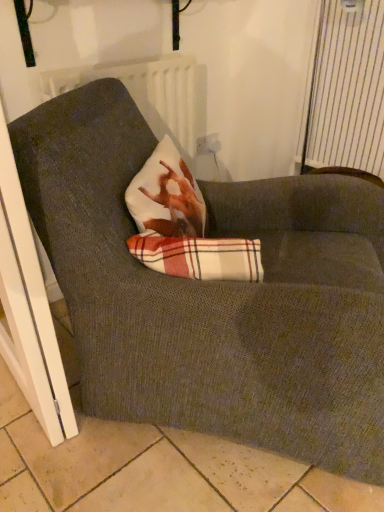
Question: Are white striped curtain at upper right and white plastic electric outlet at upper center making contact?

Choices:
 (A) yes
 (B) no

Answer: (B)

Question: Does white striped curtain at upper right lie behind white plastic electric outlet at upper center?

Choices:
 (A) yes
 (B) no

Answer: (B)

Question: From a real-world perspective, does white striped curtain at upper right sit lower than white plastic electric outlet at upper center?

Choices:
 (A) yes
 (B) no

Answer: (B)

Question: Is white striped curtain at upper right looking in the opposite direction of white plastic electric outlet at upper center?

Choices:
 (A) no
 (B) yes

Answer: (A)

Question: From a real-world perspective, is white striped curtain at upper right on top of white plastic electric outlet at upper center?

Choices:
 (A) no
 (B) yes

Answer: (B)

Question: Would you say white plastic electric outlet at upper center is to the left or to the right of white striped curtain at upper right in the picture?

Choices:
 (A) right
 (B) left

Answer: (B)

Question: From their relative heights in the image, would you say white plastic electric outlet at upper center is taller or shorter than white striped curtain at upper right?

Choices:
 (A) tall
 (B) short

Answer: (B)

Question: From the image's perspective, relative to white striped curtain at upper right, is white plastic electric outlet at upper center above or below?

Choices:
 (A) above
 (B) below

Answer: (B)

Question: Considering their positions, is white plastic electric outlet at upper center located in front of or behind white striped curtain at upper right?

Choices:
 (A) front
 (B) behind

Answer: (B)

Question: In the image, is white plastic electric outlet at upper center on the left side or the right side of plaid fabric at center?

Choices:
 (A) right
 (B) left

Answer: (A)

Question: Considering the positions of white plastic electric outlet at upper center and plaid fabric at center in the image, is white plastic electric outlet at upper center wider or thinner than plaid fabric at center?

Choices:
 (A) wide
 (B) thin

Answer: (B)

Question: Does point (206, 138) appear closer or farther from the camera than point (163, 267)?

Choices:
 (A) closer
 (B) farther

Answer: (B)

Question: From their relative heights in the image, would you say white plastic electric outlet at upper center is taller or shorter than plaid fabric at center?

Choices:
 (A) tall
 (B) short

Answer: (B)

Question: From the image's perspective, is white plastic screen door at lower left located above or below white striped curtain at upper right?

Choices:
 (A) above
 (B) below

Answer: (B)

Question: Considering the positions of white plastic screen door at lower left and white striped curtain at upper right in the image, is white plastic screen door at lower left taller or shorter than white striped curtain at upper right?

Choices:
 (A) tall
 (B) short

Answer: (A)